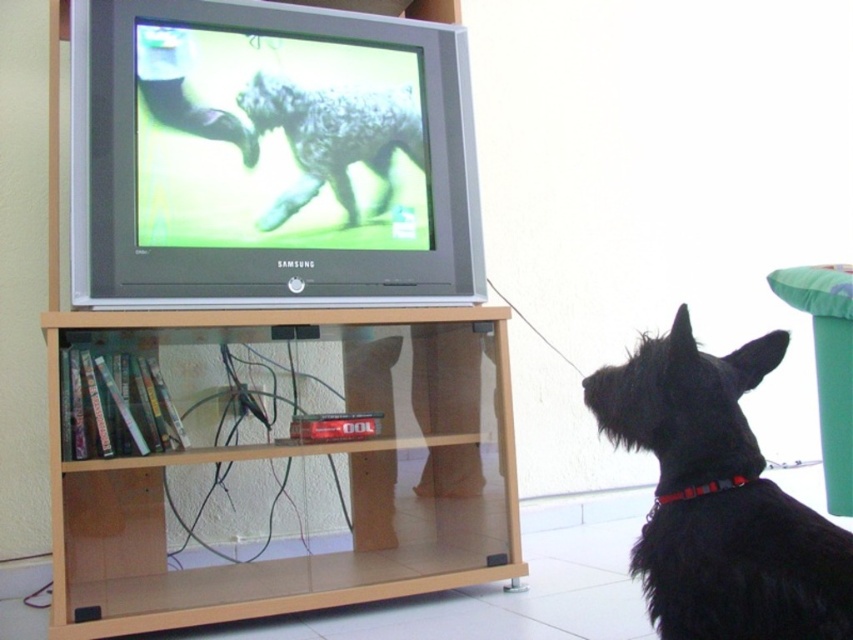
Does transparent glass bookshelf at lower center appear over fuzzy gray dog at center?

No.

Who is lower down, transparent glass bookshelf at lower center or fuzzy gray dog at center?

transparent glass bookshelf at lower center

Identify the location of transparent glass bookshelf at lower center. (297, 456).

Measure the distance from black fur dog at lower right to fuzzy gray dog at center.

black fur dog at lower right and fuzzy gray dog at center are 36.15 inches apart.

Which is below, black fur dog at lower right or fuzzy gray dog at center?

black fur dog at lower right is below.

Where is `black fur dog at lower right`? This screenshot has width=853, height=640. black fur dog at lower right is located at coordinates (718, 499).

In order to click on black fur dog at lower right in this screenshot , I will do `click(718, 499)`.

Who is higher up, transparent glass bookshelf at lower center or black fur dog at lower right?

black fur dog at lower right is higher up.

Who is positioned more to the left, transparent glass bookshelf at lower center or black fur dog at lower right?

Positioned to the left is transparent glass bookshelf at lower center.

Is point (456, 456) positioned after point (718, 579)?

Yes.

Identify the location of transparent glass bookshelf at lower center. This screenshot has width=853, height=640. (297, 456).